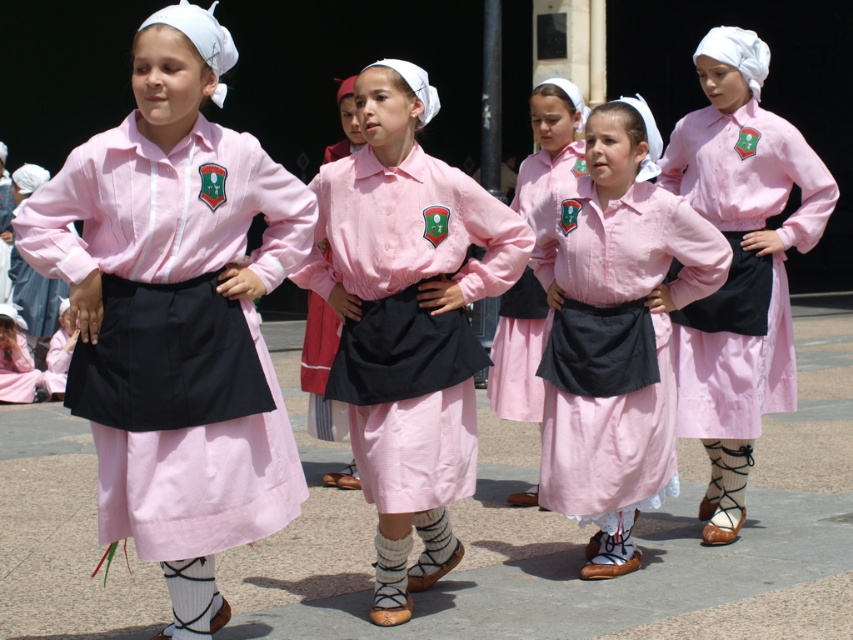
Question: Is matte pink shirt at center positioned at the back of pink cotton skirt at center?

Choices:
 (A) no
 (B) yes

Answer: (B)

Question: Which object appears farthest from the camera in this image?

Choices:
 (A) pink cotton dress at center
 (B) pink cotton skirt at left
 (C) pink cotton skirt at center
 (D) matte pink shirt at center

Answer: (D)

Question: Which point is farther from the camera taking this photo?

Choices:
 (A) (554, 458)
 (B) (55, 250)

Answer: (A)

Question: Can you confirm if pink cotton skirt at left is positioned to the left of pink cotton dress at center?

Choices:
 (A) no
 (B) yes

Answer: (B)

Question: Estimate the real-world distances between objects in this image. Which object is farther from the pink cotton skirt at center?

Choices:
 (A) matte pink shirt at center
 (B) pink cotton skirt at left

Answer: (A)

Question: Considering the relative positions of matte pink shirt at center and pink cotton skirt at center in the image provided, where is matte pink shirt at center located with respect to pink cotton skirt at center?

Choices:
 (A) right
 (B) left

Answer: (A)